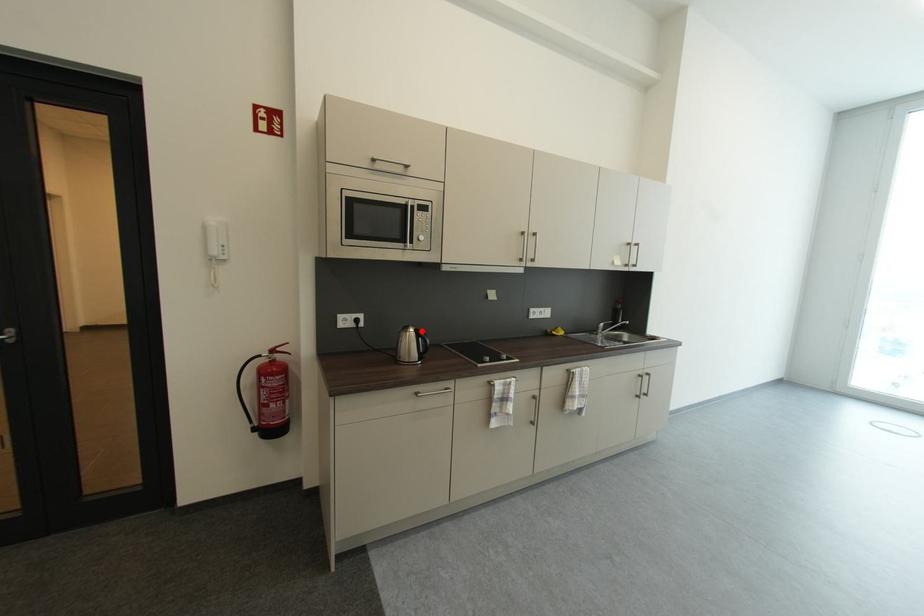
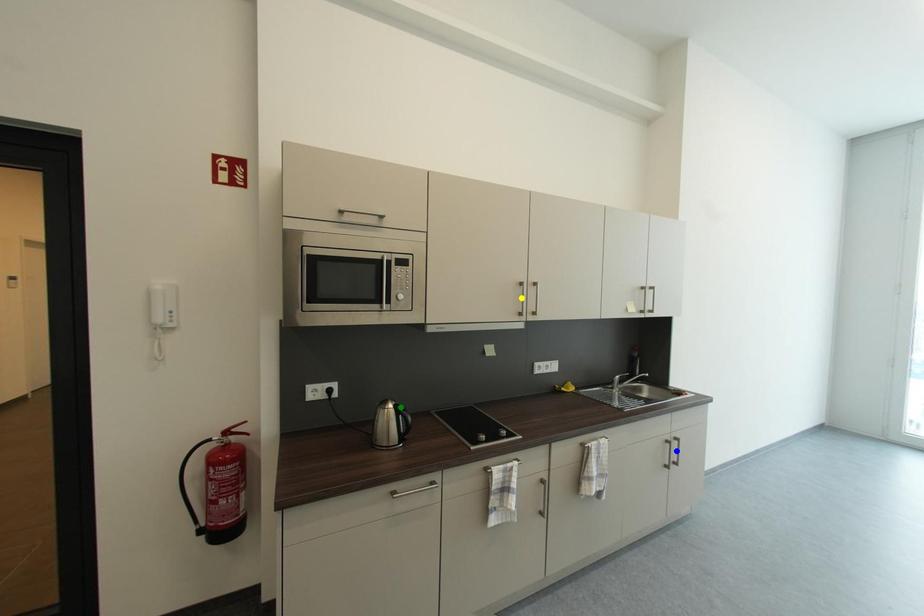
Question: I am providing you with two images of the same scene from different viewpoints. A red point is marked on the first image. You are given multiple points on the second image. In image 2, which mark is for the same physical point as the one in image 1?

Choices:
 (A) yellow point
 (B) blue point
 (C) green point

Answer: (C)